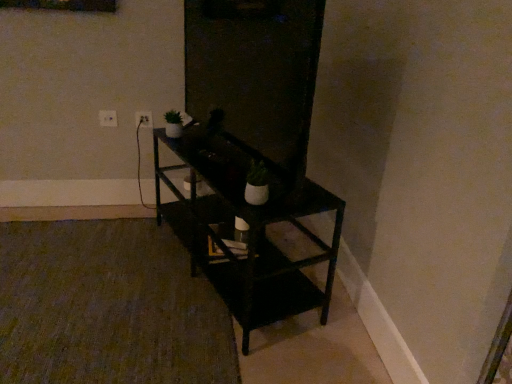
Question: Are transparent glass door at center and black matte shelf at center far apart?

Choices:
 (A) yes
 (B) no

Answer: (B)

Question: From a real-world perspective, is transparent glass door at center physically below black matte shelf at center?

Choices:
 (A) yes
 (B) no

Answer: (B)

Question: Can you confirm if transparent glass door at center is positioned to the right of black matte shelf at center?

Choices:
 (A) yes
 (B) no

Answer: (A)

Question: Is transparent glass door at center behind black matte shelf at center?

Choices:
 (A) yes
 (B) no

Answer: (B)

Question: Can you confirm if transparent glass door at center is positioned to the left of black matte shelf at center?

Choices:
 (A) no
 (B) yes

Answer: (A)

Question: Can you confirm if transparent glass door at center is thinner than black matte shelf at center?

Choices:
 (A) yes
 (B) no

Answer: (A)

Question: Does white plastic electric outlet at upper left, which is the 1th electric outlet from left to right, have a lesser height compared to white plastic electric outlet at upper left, which appears as the second electric outlet when viewed from the left?

Choices:
 (A) no
 (B) yes

Answer: (B)

Question: Are white plastic electric outlet at upper left, the second electric outlet viewed from the right, and white plastic electric outlet at upper left, which appears as the second electric outlet when viewed from the left, beside each other?

Choices:
 (A) no
 (B) yes

Answer: (A)

Question: From a real-world perspective, does white plastic electric outlet at upper left, which is the 1th electric outlet from left to right, stand above white plastic electric outlet at upper left, which appears as the second electric outlet when viewed from the left?

Choices:
 (A) yes
 (B) no

Answer: (A)

Question: Is white plastic electric outlet at upper left, which is the 1th electric outlet from left to right, far away from white plastic electric outlet at upper left, positioned as the 1th electric outlet in right-to-left order?

Choices:
 (A) yes
 (B) no

Answer: (B)

Question: From the image's perspective, does white plastic electric outlet at upper left, which is the 1th electric outlet from left to right, appear higher than white plastic electric outlet at upper left, positioned as the 1th electric outlet in right-to-left order?

Choices:
 (A) yes
 (B) no

Answer: (B)

Question: Is white plastic electric outlet at upper left, which is the 1th electric outlet from left to right, positioned before white plastic electric outlet at upper left, positioned as the 1th electric outlet in right-to-left order?

Choices:
 (A) no
 (B) yes

Answer: (B)

Question: From a real-world perspective, does black matte shelf at center stand above white plastic electric outlet at upper left, which appears as the second electric outlet when viewed from the left?

Choices:
 (A) no
 (B) yes

Answer: (A)